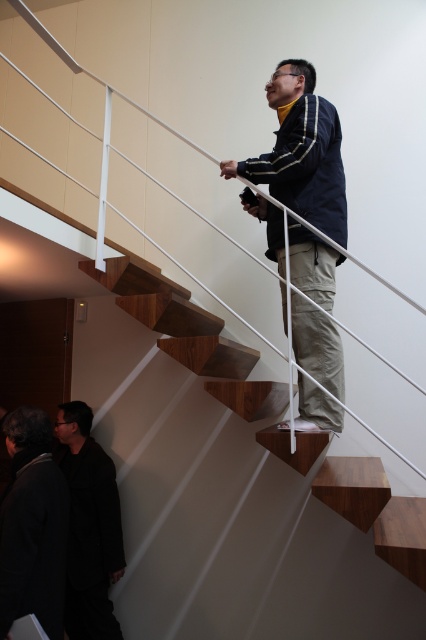
You are standing at the bottom of the staircase and see the wooden stairs at upper center and the black fabric suit at lower left. Which object is positioned to the right of the other?

The wooden stairs at upper center are positioned to the right of the black fabric suit at lower left.

You are standing at the bottom of the wooden stairs at upper center and want to reach the dark gray jacket at lower left. Which direction should you move to get closer to the jacket?

The wooden stairs at upper center is located above the dark gray jacket at lower left, so you should move downward to get closer to the dark gray jacket at lower left.

From the picture: You are a delivery person carrying a large box that is 1.5 meters tall. You need to place it on the wooden stairs at upper center or the black fabric suit at lower left. Based on their heights, where should you place the box?

The wooden stairs at upper center has a greater height compared to the black fabric suit at lower left. Therefore, you should place the large box on the wooden stairs at upper center since it can support the height of the box.